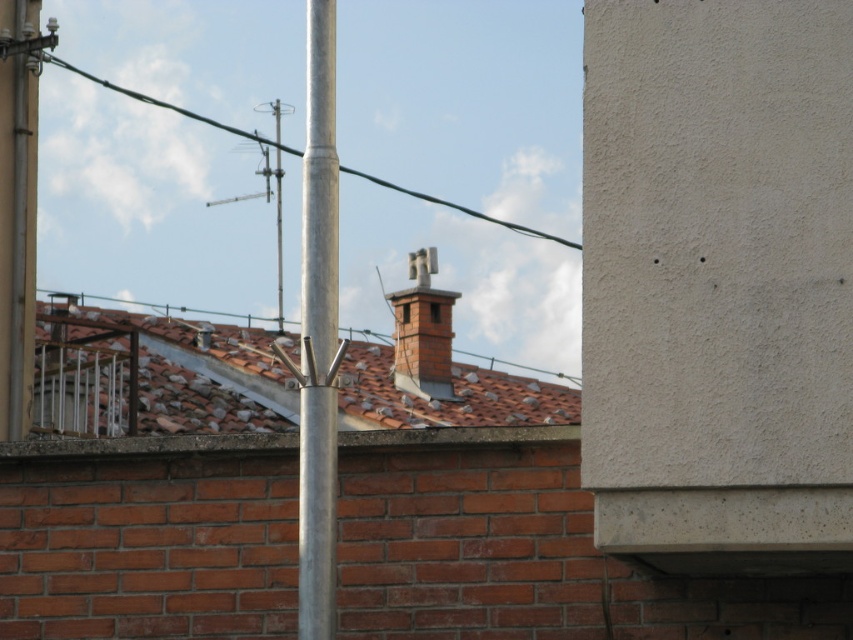
Can you confirm if silver metallic pole at center is positioned to the right of brick chimney at center?

Yes, silver metallic pole at center is to the right of brick chimney at center.

Between point (300, 260) and point (422, 353), which one is positioned behind?

The point (422, 353) is more distant.

Identify the location of silver metallic pole at center. The height and width of the screenshot is (640, 853). (318, 332).

Is point (308, 257) closer to viewer compared to point (460, 205)?

That is True.

Can you confirm if silver metallic pole at center is positioned below green wire at upper center?

Yes.

Who is more distant from viewer, (311,0) or (82,74)?

The point (82,74) is more distant.

Where is `silver metallic pole at center`? silver metallic pole at center is located at coordinates (318, 332).

Between brick chimney at center and green wire at upper center, which one appears on the left side from the viewer's perspective?

green wire at upper center is more to the left.

In the scene shown: Does brick chimney at center have a greater height compared to green wire at upper center?

No.

Which is behind, point (454, 300) or point (358, 176)?

The point (358, 176) is behind.

Locate an element on the screen. This screenshot has width=853, height=640. brick chimney at center is located at coordinates (422, 332).